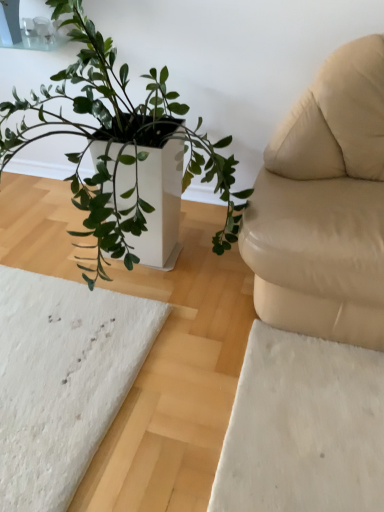
Image resolution: width=384 pixels, height=512 pixels. What are the coordinates of `blank area beneath white matte planter at center (from a real-world perspective)` in the screenshot? It's located at 134,274.